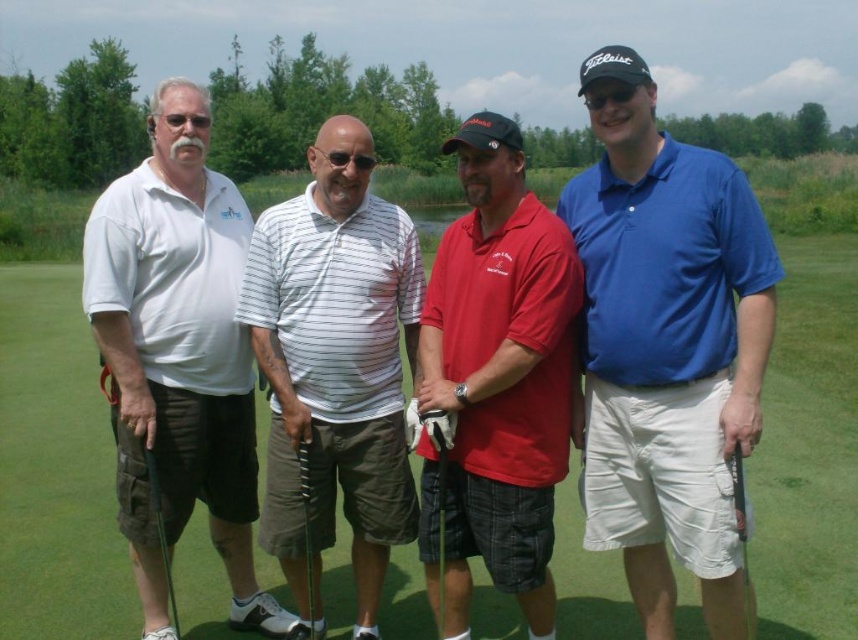
Question: Which point is closer to the camera?

Choices:
 (A) (735, 500)
 (B) (41, 483)
 (C) (437, 560)
 (D) (385, 545)

Answer: (A)

Question: Can you confirm if green grass at center is positioned below blue cotton polo shirt at center?

Choices:
 (A) no
 (B) yes

Answer: (A)

Question: Does white matte golf club at left appear on the right side of matte black golf club at lower left?

Choices:
 (A) no
 (B) yes

Answer: (A)

Question: In this image, where is black metallic golf club at center located relative to metallic silver golf club at center?

Choices:
 (A) right
 (B) left

Answer: (B)

Question: Which is nearer to the blue cotton polo shirt at center?

Choices:
 (A) white striped polo shirt at center
 (B) red cotton polo shirt at center

Answer: (B)

Question: Which point appears farthest from the camera in this image?

Choices:
 (A) pos(748,609)
 (B) pos(536,324)
 (C) pos(156,538)

Answer: (C)